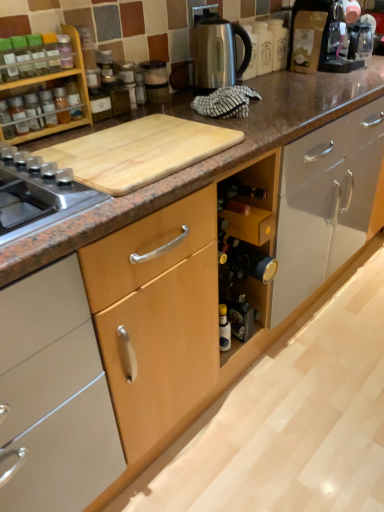
This screenshot has height=512, width=384. Describe the element at coordinates (6, 121) in the screenshot. I see `matte glass bottle at left, the 3th bottle viewed from the right` at that location.

Find the location of a particular element. natural wood cutting board at upper left is located at coordinates (139, 151).

This screenshot has width=384, height=512. What do you see at coordinates (48, 108) in the screenshot? I see `translucent glass spice at upper left, the second bottle in the left-to-right sequence` at bounding box center [48, 108].

Where is `metallic silver blender at upper center, marked as the 2th appliance in a right-to-left arrangement`? Image resolution: width=384 pixels, height=512 pixels. metallic silver blender at upper center, marked as the 2th appliance in a right-to-left arrangement is located at coordinates (155, 81).

The height and width of the screenshot is (512, 384). What are the coordinates of `matte glass bottle at left, the 3th bottle viewed from the right` in the screenshot? It's located at (6, 121).

From a real-world perspective, between translucent glass spice at upper left, the 2th bottle when ordered from right to left, and satin silver kettle at upper center, the first appliance positioned from the right, who is vertically lower?

translucent glass spice at upper left, the 2th bottle when ordered from right to left.

Can you tell me how much translucent glass spice at upper left, the second bottle in the left-to-right sequence, and satin silver kettle at upper center, which appears as the second appliance when viewed from the left, differ in facing direction?

The angle between the facing direction of translucent glass spice at upper left, the second bottle in the left-to-right sequence, and the facing direction of satin silver kettle at upper center, which appears as the second appliance when viewed from the left, is 2.67 degrees.

Is translucent glass spice at upper left, the 2th bottle when ordered from right to left, inside or outside of satin silver kettle at upper center, the first appliance positioned from the right?

translucent glass spice at upper left, the 2th bottle when ordered from right to left, lies outside satin silver kettle at upper center, the first appliance positioned from the right.

Would you say satin silver kettle at upper center, the first appliance positioned from the right, is to the left or to the right of natural wood cutting board at upper left in the picture?

Based on their positions, satin silver kettle at upper center, the first appliance positioned from the right, is located to the right of natural wood cutting board at upper left.

Can you see satin silver kettle at upper center, which appears as the second appliance when viewed from the left, touching natural wood cutting board at upper left?

There is a gap between satin silver kettle at upper center, which appears as the second appliance when viewed from the left, and natural wood cutting board at upper left.

Which object is wider, satin silver kettle at upper center, the first appliance positioned from the right, or natural wood cutting board at upper left?

Wider between the two is natural wood cutting board at upper left.

How much distance is there between satin silver kettle at upper center, the first appliance positioned from the right, and natural wood cutting board at upper left?

The distance of satin silver kettle at upper center, the first appliance positioned from the right, from natural wood cutting board at upper left is 22.00 inches.

From the image's perspective, which is above, green glass wine bottle at center or translucent glass spice at upper left, the 2th bottle when ordered from right to left?

translucent glass spice at upper left, the 2th bottle when ordered from right to left, appears higher in the image.

Is green glass wine bottle at center positioned in front of translucent glass spice at upper left, the second bottle in the left-to-right sequence?

No.

Is green glass wine bottle at center to the right of translucent glass spice at upper left, the 2th bottle when ordered from right to left, from the viewer's perspective?

Yes.

Are green glass wine bottle at center and matte glass bottle at left, the 3th bottle viewed from the right, located far from each other?

That's not correct — green glass wine bottle at center is a little close to matte glass bottle at left, the 3th bottle viewed from the right.

Would you say green glass wine bottle at center is outside matte glass bottle at left, the 3th bottle viewed from the right?

green glass wine bottle at center is positioned outside matte glass bottle at left, the 3th bottle viewed from the right.

From a real-world perspective, which object stands above the other?

matte glass bottle at left, the 3th bottle viewed from the right, from a real-world perspective.

In the image, is green glass wine bottle at center on the left side or the right side of matte glass bottle at left, positioned as the 1th bottle in left-to-right order?

In the image, green glass wine bottle at center appears on the right side of matte glass bottle at left, positioned as the 1th bottle in left-to-right order.

Considering the relative sizes of metallic silver blender at upper center, marked as the 2th appliance in a right-to-left arrangement, and wooden spice rack at upper left in the image provided, is metallic silver blender at upper center, marked as the 2th appliance in a right-to-left arrangement, bigger than wooden spice rack at upper left?

No.

Is the surface of metallic silver blender at upper center, positioned as the first appliance in left-to-right order, in direct contact with wooden spice rack at upper left?

There is a gap between metallic silver blender at upper center, positioned as the first appliance in left-to-right order, and wooden spice rack at upper left.

How far apart are metallic silver blender at upper center, positioned as the first appliance in left-to-right order, and wooden spice rack at upper left?

13.93 inches.

Considering the points (149, 81) and (30, 133), which point is behind, point (149, 81) or point (30, 133)?

The point (149, 81) is farther.

Can you see green glass wine bottle at center touching wooden spice rack at upper left?

green glass wine bottle at center and wooden spice rack at upper left are not in contact.

Which object is further away from the camera, green glass wine bottle at center or wooden spice rack at upper left?

green glass wine bottle at center is more distant.

I want to click on the 2nd appliance to the right of the translucent glass spice at upper left, marked as the first bottle in a right-to-left arrangement, counting from the anchor's position, so click(216, 50).

In the scene shown: From a real-world perspective, between satin silver kettle at upper center, the first appliance positioned from the right, and translucent glass spice at upper left, the 3th bottle positioned from the left, who is vertically lower?

translucent glass spice at upper left, the 3th bottle positioned from the left, from a real-world perspective.

Is satin silver kettle at upper center, the first appliance positioned from the right, shorter than translucent glass spice at upper left, the 3th bottle positioned from the left?

No, satin silver kettle at upper center, the first appliance positioned from the right, is not shorter than translucent glass spice at upper left, the 3th bottle positioned from the left.

This screenshot has height=512, width=384. Find the location of `the 2nd bottle in front of the satin silver kettle at upper center, the first appliance positioned from the right, starting your count from the anchor`. the 2nd bottle in front of the satin silver kettle at upper center, the first appliance positioned from the right, starting your count from the anchor is located at coordinates (48, 108).

Identify the location of cutting board on the left of satin silver kettle at upper center, which appears as the second appliance when viewed from the left. (139, 151).

When comparing their distances from translucent glass spice at upper left, the second bottle in the left-to-right sequence, does natural wood cutting board at upper left or wooden spice rack at upper left seem closer?

wooden spice rack at upper left.

When comparing their distances from satin silver kettle at upper center, the first appliance positioned from the right, does green glass wine bottle at center or metallic silver blender at upper center, marked as the 2th appliance in a right-to-left arrangement, seem further?

green glass wine bottle at center.

Looking at the image, which one is located closer to green glass wine bottle at center, metallic silver blender at upper center, positioned as the first appliance in left-to-right order, or matte glass bottle at left, positioned as the 1th bottle in left-to-right order?

metallic silver blender at upper center, positioned as the first appliance in left-to-right order.

Estimate the real-world distances between objects in this image. Which object is further from metallic silver blender at upper center, positioned as the first appliance in left-to-right order, wooden spice rack at upper left or natural wood cutting board at upper left?

natural wood cutting board at upper left.

From the image, which object appears to be nearer to green glass wine bottle at center, translucent glass spice at upper left, the 2th bottle when ordered from right to left, or matte glass bottle at left, positioned as the 1th bottle in left-to-right order?

translucent glass spice at upper left, the 2th bottle when ordered from right to left, is positioned closer to the anchor green glass wine bottle at center.

Looking at the image, which one is located further to translucent glass spice at upper left, marked as the first bottle in a right-to-left arrangement, natural wood cutting board at upper left or green glass wine bottle at center?

green glass wine bottle at center lies further to translucent glass spice at upper left, marked as the first bottle in a right-to-left arrangement, than the other object.

When comparing their distances from translucent glass spice at upper left, marked as the first bottle in a right-to-left arrangement, does green glass wine bottle at center or satin silver kettle at upper center, which appears as the second appliance when viewed from the left, seem closer?

Based on the image, satin silver kettle at upper center, which appears as the second appliance when viewed from the left, appears to be nearer to translucent glass spice at upper left, marked as the first bottle in a right-to-left arrangement.

Considering their positions, is matte glass bottle at left, the 3th bottle viewed from the right, positioned closer to translucent glass spice at upper left, the 3th bottle positioned from the left, than wooden spice rack at upper left?

The object closer to translucent glass spice at upper left, the 3th bottle positioned from the left, is wooden spice rack at upper left.

Locate an element on the screen. Image resolution: width=384 pixels, height=512 pixels. cutting board located between matte glass bottle at left, positioned as the 1th bottle in left-to-right order, and green glass wine bottle at center in the left-right direction is located at coordinates (139, 151).

I want to click on kitchen appliance located between matte glass bottle at left, positioned as the 1th bottle in left-to-right order, and green glass wine bottle at center in the left-right direction, so click(52, 87).

Where is `cutting board between matte glass bottle at left, the 3th bottle viewed from the right, and satin silver kettle at upper center, the first appliance positioned from the right`? Image resolution: width=384 pixels, height=512 pixels. cutting board between matte glass bottle at left, the 3th bottle viewed from the right, and satin silver kettle at upper center, the first appliance positioned from the right is located at coordinates (139, 151).

In order to click on kitchen appliance between satin silver kettle at upper center, which appears as the second appliance when viewed from the left, and green glass wine bottle at center in the up-down direction in this screenshot , I will do `click(52, 87)`.